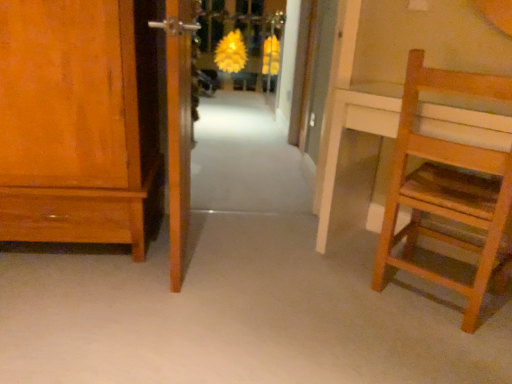
Question: Is matte wood cabinet at left surrounding wooden door at center, which ranks as the second door in left-to-right order?

Choices:
 (A) no
 (B) yes

Answer: (A)

Question: Does matte wood cabinet at left have a lesser width compared to wooden door at center, positioned as the second door in front-to-back order?

Choices:
 (A) no
 (B) yes

Answer: (A)

Question: Considering the relative sizes of matte wood cabinet at left and wooden door at center, acting as the first door starting from the back, in the image provided, is matte wood cabinet at left smaller than wooden door at center, acting as the first door starting from the back,?

Choices:
 (A) no
 (B) yes

Answer: (A)

Question: From a real-world perspective, is matte wood cabinet at left under wooden door at center, which ranks as the second door in left-to-right order?

Choices:
 (A) no
 (B) yes

Answer: (B)

Question: Is matte wood cabinet at left in front of wooden door at center, positioned as the second door in front-to-back order?

Choices:
 (A) no
 (B) yes

Answer: (B)

Question: Do you think white carpet at center is within wooden door at left, which is the 2th door in right-to-left order, or outside of it?

Choices:
 (A) inside
 (B) outside

Answer: (B)

Question: In terms of height, does white carpet at center look taller or shorter compared to wooden door at left, which is the 2th door in right-to-left order?

Choices:
 (A) tall
 (B) short

Answer: (B)

Question: From a real-world perspective, is white carpet at center above or below wooden door at left, which appears as the 1th door when viewed from the left?

Choices:
 (A) below
 (B) above

Answer: (A)

Question: Is point (234, 124) closer or farther from the camera than point (180, 74)?

Choices:
 (A) farther
 (B) closer

Answer: (A)

Question: Looking at their shapes, would you say wooden door at center, positioned as the second door in front-to-back order, is wider or thinner than yellow matte flower at center?

Choices:
 (A) wide
 (B) thin

Answer: (B)

Question: From the image's perspective, is wooden door at center, acting as the first door starting from the back, located above or below yellow matte flower at center?

Choices:
 (A) below
 (B) above

Answer: (A)

Question: In the image, is wooden door at center, the 1th door positioned from the right, on the left side or the right side of yellow matte flower at center?

Choices:
 (A) right
 (B) left

Answer: (A)

Question: From a real-world perspective, is wooden door at center, acting as the first door starting from the back, positioned above or below yellow matte flower at center?

Choices:
 (A) below
 (B) above

Answer: (B)

Question: Is point (290, 210) closer or farther from the camera than point (330, 48)?

Choices:
 (A) farther
 (B) closer

Answer: (A)

Question: Considering the positions of white carpet at center and wooden door at center, positioned as the second door in front-to-back order, in the image, is white carpet at center wider or thinner than wooden door at center, positioned as the second door in front-to-back order,?

Choices:
 (A) thin
 (B) wide

Answer: (B)